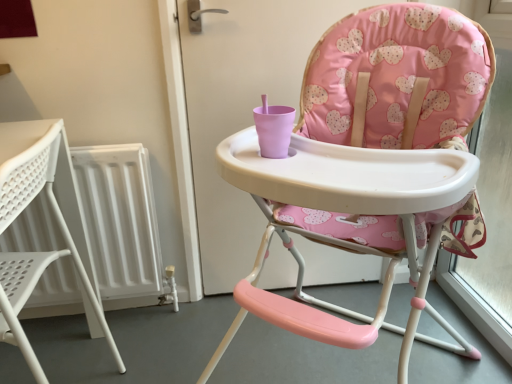
Question: Looking at the image, does white plastic chair at left, which ranks as the first chair in left-to-right order, seem bigger or smaller compared to pink fabric highchair at center, placed as the 2th chair when sorted from left to right?

Choices:
 (A) big
 (B) small

Answer: (B)

Question: From a real-world perspective, is white plastic chair at left, the second chair in the right-to-left sequence, physically located above or below pink fabric highchair at center, placed as the 2th chair when sorted from left to right?

Choices:
 (A) above
 (B) below

Answer: (B)

Question: Does point (42, 155) appear closer or farther from the camera than point (302, 99)?

Choices:
 (A) farther
 (B) closer

Answer: (B)

Question: From the image's perspective, is pink fabric highchair at center, the first chair when ordered from right to left, above or below white plastic chair at left, the second chair in the right-to-left sequence?

Choices:
 (A) above
 (B) below

Answer: (A)

Question: From a real-world perspective, is pink fabric highchair at center, placed as the 2th chair when sorted from left to right, above or below white plastic chair at left, which ranks as the first chair in left-to-right order?

Choices:
 (A) above
 (B) below

Answer: (A)

Question: Is pink fabric highchair at center, placed as the 2th chair when sorted from left to right, wider or thinner than white plastic chair at left, the second chair in the right-to-left sequence?

Choices:
 (A) thin
 (B) wide

Answer: (B)

Question: From their relative heights in the image, would you say pink fabric highchair at center, placed as the 2th chair when sorted from left to right, is taller or shorter than white plastic chair at left, which ranks as the first chair in left-to-right order?

Choices:
 (A) tall
 (B) short

Answer: (A)